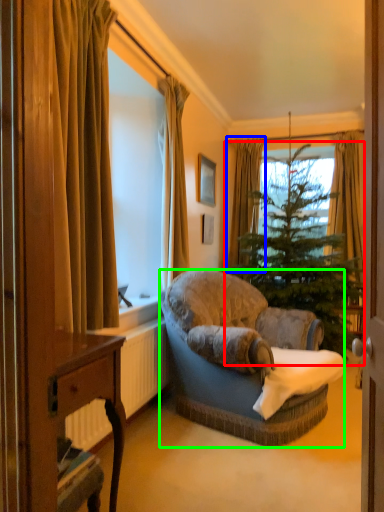
Question: Based on their relative distances, which object is farther from christmas tree (highlighted by a red box)? Choose from curtain (highlighted by a blue box) and studio couch (highlighted by a green box).

Choices:
 (A) curtain
 (B) studio couch

Answer: (B)